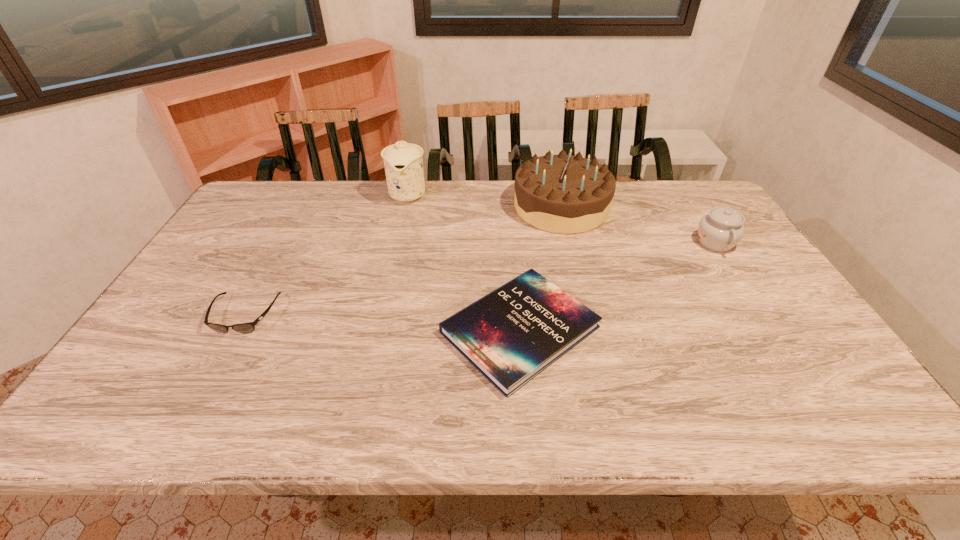
The height and width of the screenshot is (540, 960). In order to click on vacant area that lies between the right chinaware and the shortest object in this screenshot , I will do point(618,286).

Where is `free space between the leftmost object and the rightmost object`? This screenshot has height=540, width=960. free space between the leftmost object and the rightmost object is located at coordinates (480, 279).

The width and height of the screenshot is (960, 540). What are the coordinates of `vacant point located between the hardback book and the shorter chinaware` in the screenshot? It's located at (618, 286).

Identify the location of object that is the fourth closest to the leftmost object. click(x=720, y=230).

You are a GUI agent. You are given a task and a screenshot of the screen. Output one action in this format:
    pyautogui.click(x=<x>, y=<y>)
    Task: Click on the second closest object to the farther chinaware
    
    Given the screenshot: What is the action you would take?
    (512, 334)

Where is `vacant space that satisfies the following two spatial constraints: 1. on the back side of the rightmost object; 2. on the right side of the hardback book`? This screenshot has height=540, width=960. vacant space that satisfies the following two spatial constraints: 1. on the back side of the rightmost object; 2. on the right side of the hardback book is located at coordinates (513, 242).

Image resolution: width=960 pixels, height=540 pixels. What are the coordinates of `blank area in the image that satisfies the following two spatial constraints: 1. on the spout of the third shortest object; 2. on the right side of the farther chinaware` in the screenshot? It's located at (397, 242).

Find the location of `free region that satisfies the following two spatial constraints: 1. on the front-facing side of the sunglasses; 2. on the left side of the shortest object`. free region that satisfies the following two spatial constraints: 1. on the front-facing side of the sunglasses; 2. on the left side of the shortest object is located at coordinates (237, 329).

Image resolution: width=960 pixels, height=540 pixels. In order to click on blank space that satisfies the following two spatial constraints: 1. on the front-facing side of the birthday cake; 2. on the right side of the rightmost object in this screenshot , I will do `click(570, 242)`.

This screenshot has width=960, height=540. What are the coordinates of `vacant area in the image that satisfies the following two spatial constraints: 1. on the front-facing side of the fourth shortest object; 2. on the front-facing side of the leftmost object` in the screenshot? It's located at (588, 315).